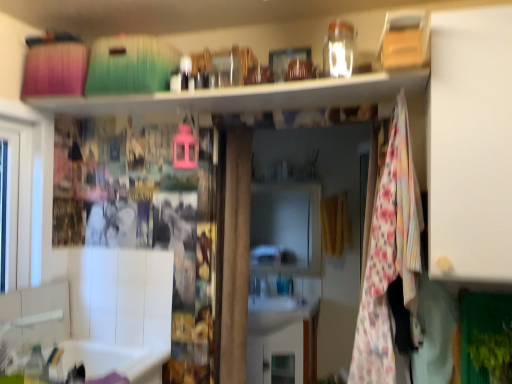
Question: Considering the relative sizes of white glossy cabinet at center and floral fabric blanket at center-right in the image provided, is white glossy cabinet at center thinner than floral fabric blanket at center-right?

Choices:
 (A) no
 (B) yes

Answer: (B)

Question: Is floral fabric blanket at center-right inside white glossy cabinet at center?

Choices:
 (A) yes
 (B) no

Answer: (B)

Question: Is white glossy cabinet at center facing away from floral fabric blanket at center-right?

Choices:
 (A) yes
 (B) no

Answer: (B)

Question: Does white glossy cabinet at center appear on the left side of floral fabric blanket at center-right?

Choices:
 (A) no
 (B) yes

Answer: (B)

Question: Are white glossy cabinet at center and floral fabric blanket at center-right far apart?

Choices:
 (A) no
 (B) yes

Answer: (B)

Question: From the image's perspective, is white matte cabinet at right above or below white glossy cabinet at center?

Choices:
 (A) above
 (B) below

Answer: (A)

Question: Considering their positions, is white matte cabinet at right located in front of or behind white glossy cabinet at center?

Choices:
 (A) behind
 (B) front

Answer: (B)

Question: From a real-world perspective, is white matte cabinet at right positioned above or below white glossy cabinet at center?

Choices:
 (A) below
 (B) above

Answer: (B)

Question: Based on their positions, is white matte cabinet at right located to the left or right of white glossy cabinet at center?

Choices:
 (A) left
 (B) right

Answer: (B)

Question: Is white matte cabinet at right situated inside floral fabric blanket at center-right or outside?

Choices:
 (A) outside
 (B) inside

Answer: (A)

Question: Considering the positions of white matte cabinet at right and floral fabric blanket at center-right in the image, is white matte cabinet at right taller or shorter than floral fabric blanket at center-right?

Choices:
 (A) tall
 (B) short

Answer: (B)

Question: Considering the relative positions of white matte cabinet at right and floral fabric blanket at center-right in the image provided, is white matte cabinet at right to the left or to the right of floral fabric blanket at center-right?

Choices:
 (A) right
 (B) left

Answer: (A)

Question: In terms of width, does white matte cabinet at right look wider or thinner when compared to floral fabric blanket at center-right?

Choices:
 (A) wide
 (B) thin

Answer: (A)

Question: Considering the positions of point [269, 319] and point [360, 301], is point [269, 319] closer or farther from the camera than point [360, 301]?

Choices:
 (A) farther
 (B) closer

Answer: (A)

Question: From the image's perspective, is white glossy cabinet at center located above or below floral fabric blanket at center-right?

Choices:
 (A) below
 (B) above

Answer: (A)